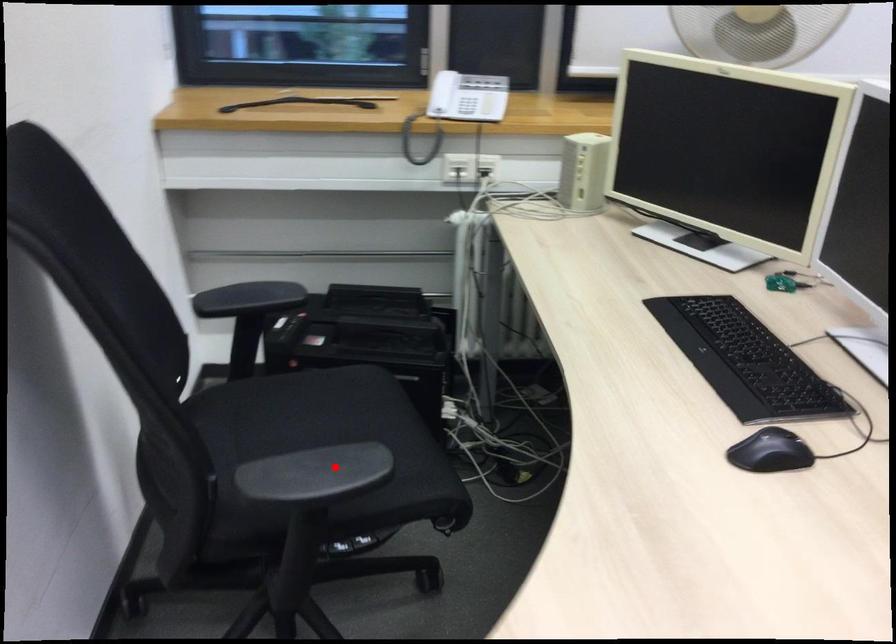
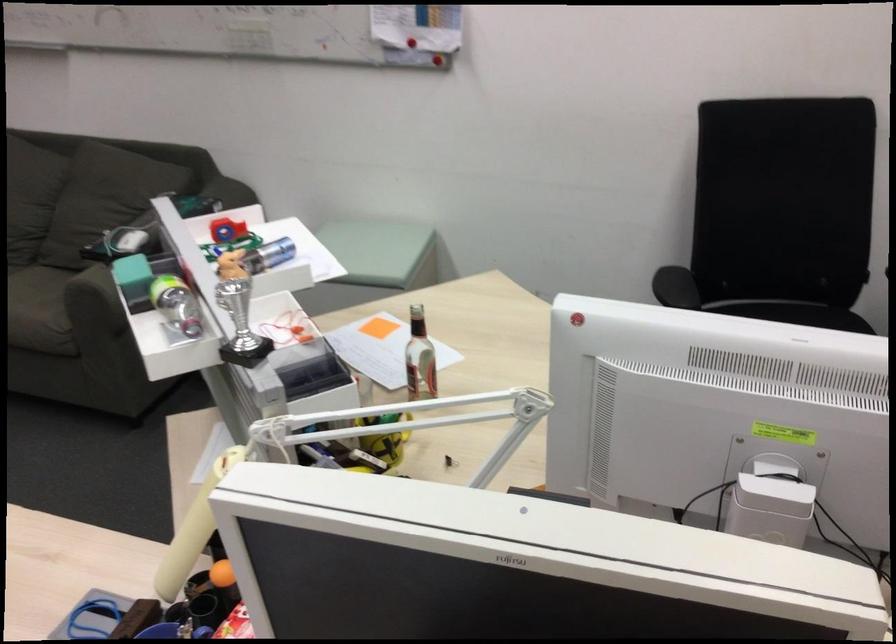
Question: I am providing you with two images of the same scene from different viewpoints. A red point is marked on the first image. Can you still see the location of the red point in image 2?

Choices:
 (A) Yes
 (B) No

Answer: (A)